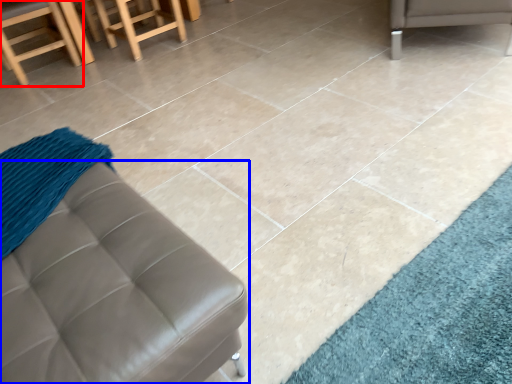
Question: Which point is further to the camera, chair (highlighted by a red box) or furniture (highlighted by a blue box)?

Choices:
 (A) chair
 (B) furniture

Answer: (A)